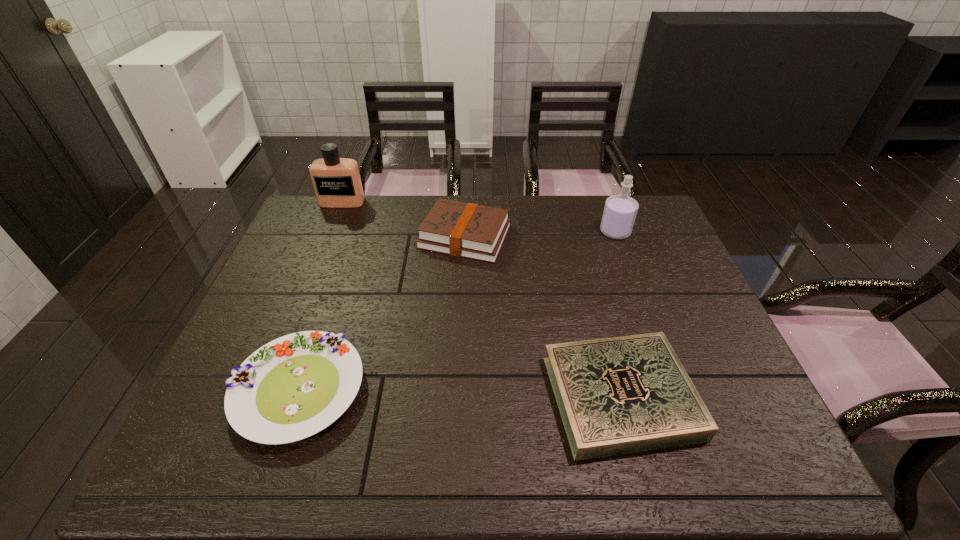
Locate an element on the screen. The height and width of the screenshot is (540, 960). vacant space that satisfies the following two spatial constraints: 1. on the front label of the salad plate; 2. on the left side of the left perfume is located at coordinates (266, 389).

This screenshot has width=960, height=540. I want to click on vacant space that satisfies the following two spatial constraints: 1. on the front label of the nearer hardback book; 2. on the right side of the farther perfume, so click(x=263, y=396).

At what (x,y) coordinates should I click in order to perform the action: click on vacant area in the image that satisfies the following two spatial constraints: 1. on the front label of the salad plate; 2. on the right side of the farthest object. Please return your answer as a coordinate pair (x, y). The height and width of the screenshot is (540, 960). Looking at the image, I should click on (266, 389).

Where is `vacant space that satisfies the following two spatial constraints: 1. on the front label of the taller hardback book; 2. on the left side of the farthest object`? vacant space that satisfies the following two spatial constraints: 1. on the front label of the taller hardback book; 2. on the left side of the farthest object is located at coordinates (x=328, y=237).

Identify the location of free spot that satisfies the following two spatial constraints: 1. on the front label of the right perfume; 2. on the left side of the left perfume. (330, 232).

Locate an element on the screen. This screenshot has width=960, height=540. vacant space that satisfies the following two spatial constraints: 1. on the front label of the left perfume; 2. on the right side of the nearer perfume is located at coordinates (330, 232).

Locate an element on the screen. This screenshot has height=540, width=960. free location that satisfies the following two spatial constraints: 1. on the front label of the taller hardback book; 2. on the left side of the farthest object is located at coordinates (328, 237).

Find the location of a particular element. blank area in the image that satisfies the following two spatial constraints: 1. on the back side of the salad plate; 2. on the left side of the taller hardback book is located at coordinates (351, 237).

Locate an element on the screen. vacant space that satisfies the following two spatial constraints: 1. on the front side of the third shortest object; 2. on the right side of the nearer hardback book is located at coordinates coord(458,396).